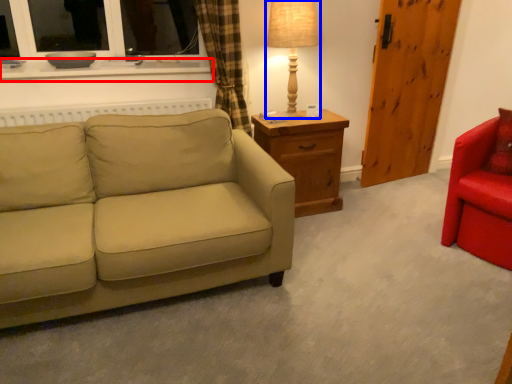
Question: Which of the following is the closest to the observer, window sill (highlighted by a red box) or table lamp (highlighted by a blue box)?

Choices:
 (A) window sill
 (B) table lamp

Answer: (A)